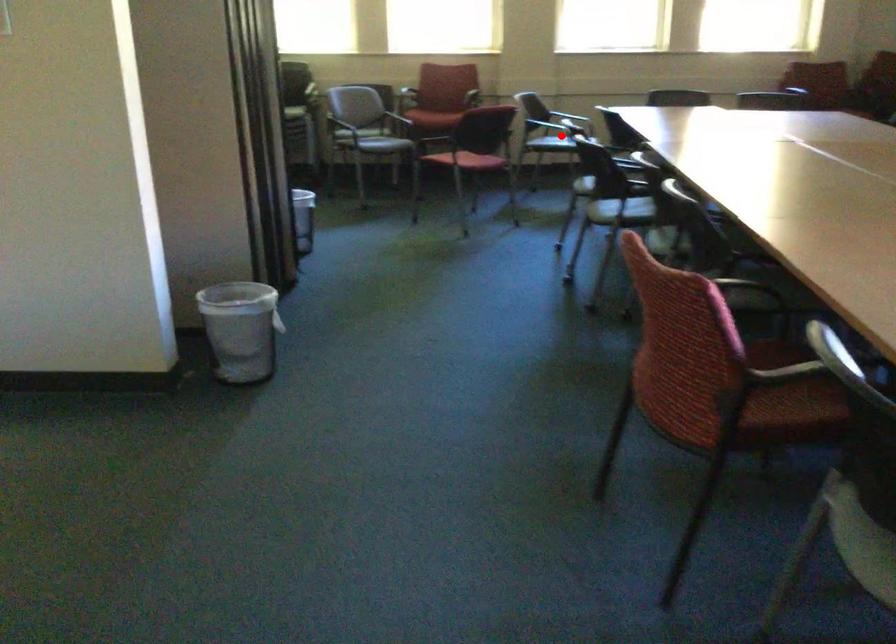
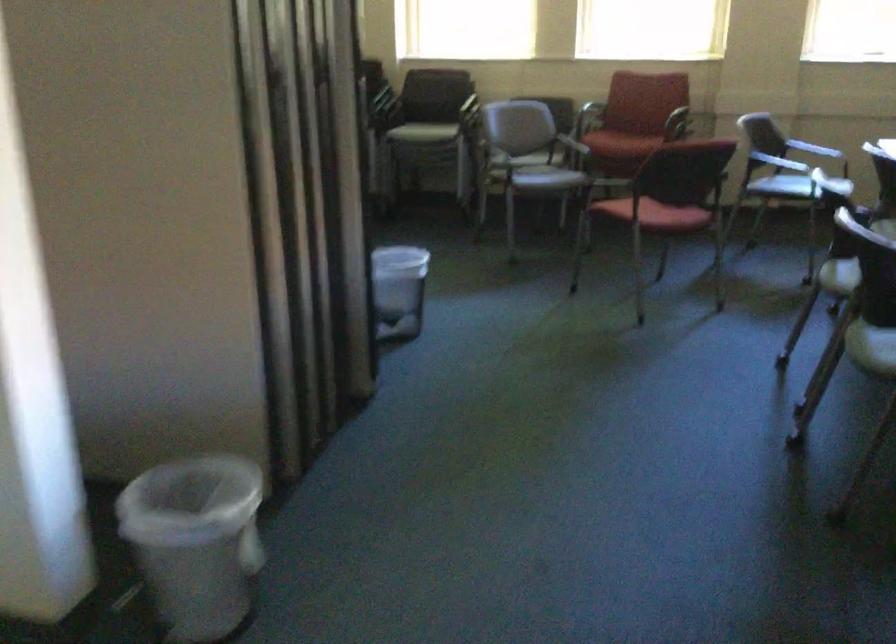
Locate, in the second image, the point that corresponds to the highlighted location in the first image.

(780, 162)